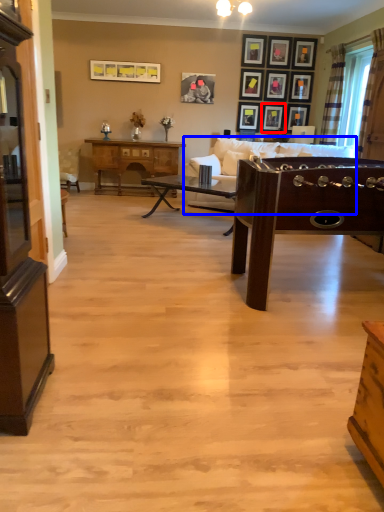
Question: Which point is further to the camera, picture frame (highlighted by a red box) or studio couch (highlighted by a blue box)?

Choices:
 (A) picture frame
 (B) studio couch

Answer: (A)